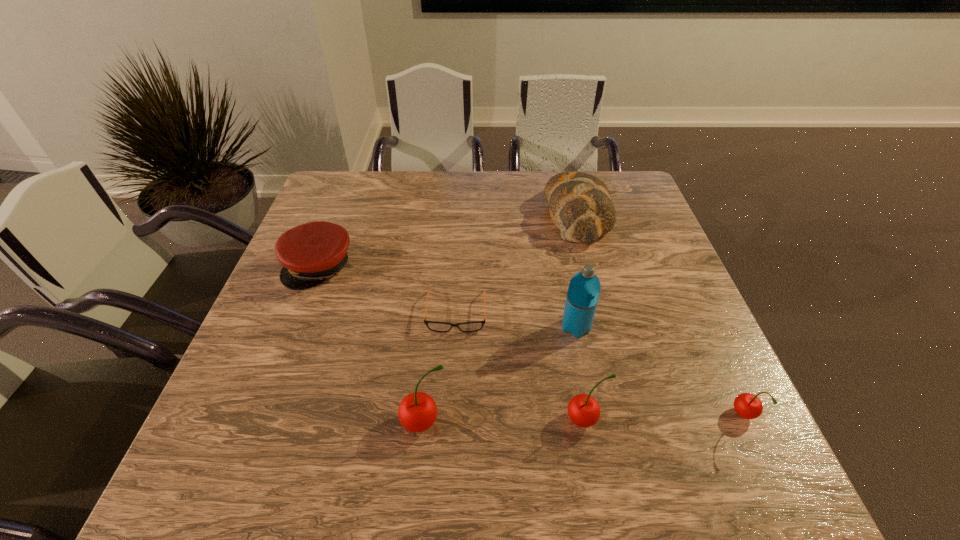
The image size is (960, 540). Find the location of `unoccupied area between the thermos bottle and the bread`. unoccupied area between the thermos bottle and the bread is located at coordinates (x=576, y=271).

Where is `vacant area that lies between the spectacles and the leftmost object`? This screenshot has height=540, width=960. vacant area that lies between the spectacles and the leftmost object is located at coordinates (388, 289).

Find the location of a particular element. The width and height of the screenshot is (960, 540). free space between the rightmost object and the shortest object is located at coordinates (600, 364).

Locate an element on the screen. free point between the second tallest cherry and the leftmost object is located at coordinates (452, 343).

Where is `vacant space in between the cap and the sixth shortest object`? vacant space in between the cap and the sixth shortest object is located at coordinates (372, 345).

Locate an element on the screen. This screenshot has width=960, height=540. free space between the leftmost object and the spectacles is located at coordinates (388, 289).

In order to click on object that is the fourth closest to the bread in this screenshot , I will do `click(748, 406)`.

Choose which object is the second nearest neighbor to the rightmost object. Please provide its 2D coordinates. Your answer should be formatted as a tuple, i.e. [(x, y)], where the tuple contains the x and y coordinates of a point satisfying the conditions above.

[(583, 293)]

Choose which cherry is the third nearest neighbor to the spectacles. Please provide its 2D coordinates. Your answer should be formatted as a tuple, i.e. [(x, y)], where the tuple contains the x and y coordinates of a point satisfying the conditions above.

[(748, 406)]

Identify which cherry is located as the nearest to the bread. Please provide its 2D coordinates. Your answer should be formatted as a tuple, i.e. [(x, y)], where the tuple contains the x and y coordinates of a point satisfying the conditions above.

[(583, 410)]